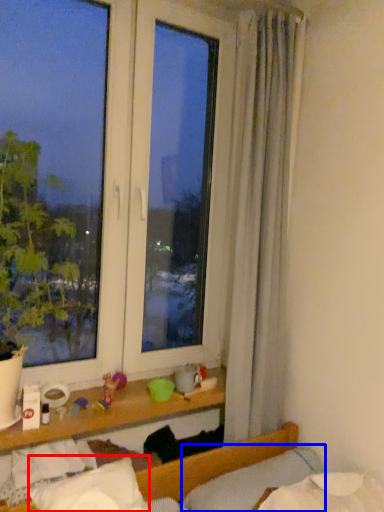
Question: Which point is closer to the camera, pillow (highlighted by a red box) or pillow (highlighted by a blue box)?

Choices:
 (A) pillow
 (B) pillow

Answer: (A)